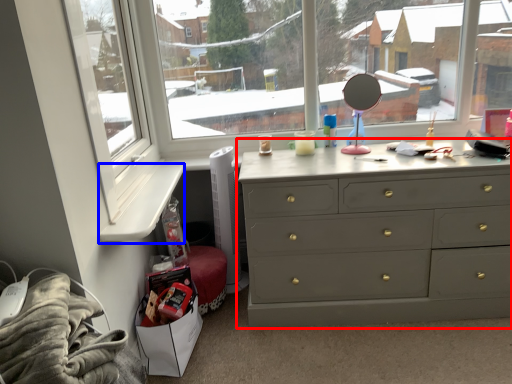
Question: Which object is further to the camera taking this photo, chest of drawers (highlighted by a red box) or window sill (highlighted by a blue box)?

Choices:
 (A) chest of drawers
 (B) window sill

Answer: (A)